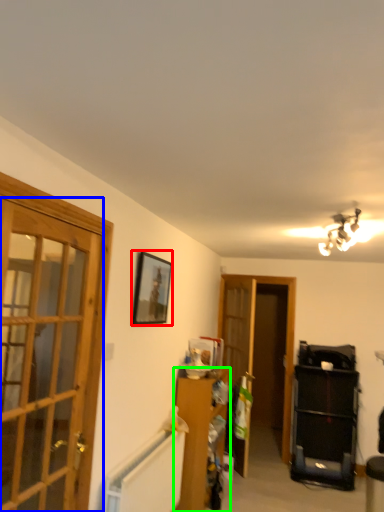
Question: Which object is positioned farthest from picture frame (highlighted by a red box)? Select from door (highlighted by a blue box) and furniture (highlighted by a green box).

Choices:
 (A) door
 (B) furniture

Answer: (A)